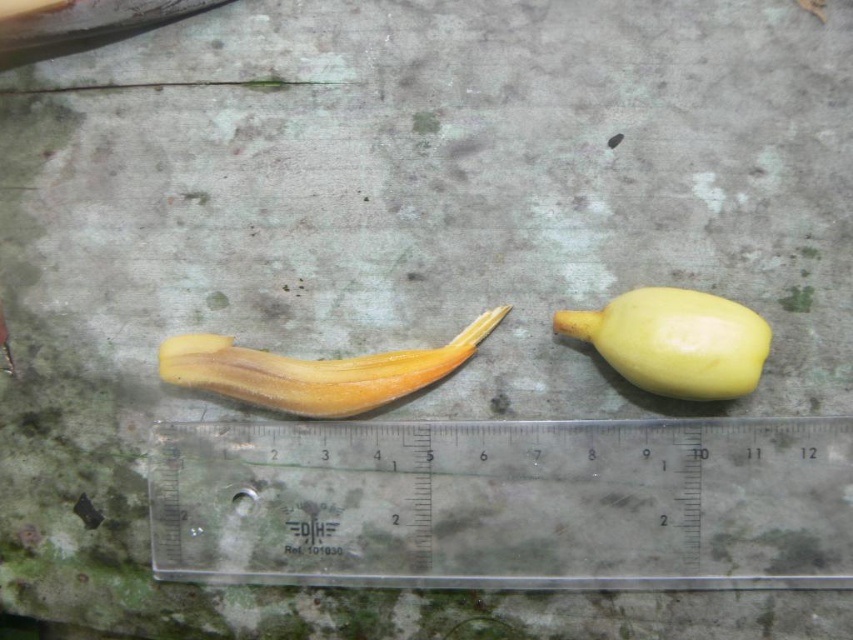
Question: Is transparent plastic ruler at center smaller than yellow matte banana at center?

Choices:
 (A) yes
 (B) no

Answer: (B)

Question: Is transparent plastic ruler at center thinner than yellow matte fruit at right?

Choices:
 (A) yes
 (B) no

Answer: (B)

Question: Which point is closer to the camera taking this photo?

Choices:
 (A) (779, 472)
 (B) (697, 369)

Answer: (B)

Question: Estimate the real-world distances between objects in this image. Which object is closer to the yellow matte fruit at right?

Choices:
 (A) transparent plastic ruler at center
 (B) yellow matte banana at center

Answer: (A)

Question: Estimate the real-world distances between objects in this image. Which object is closer to the yellow matte fruit at right?

Choices:
 (A) yellow matte banana at center
 (B) transparent plastic ruler at center

Answer: (B)

Question: Where is transparent plastic ruler at center located in relation to yellow matte fruit at right in the image?

Choices:
 (A) below
 (B) above

Answer: (A)